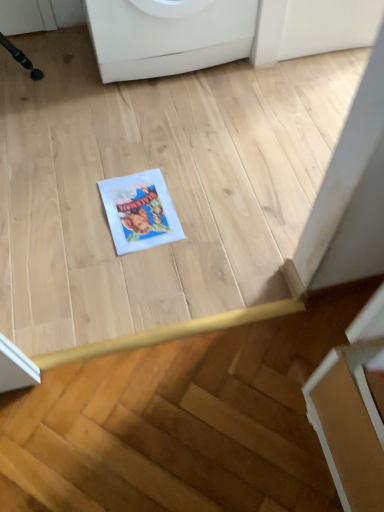
Find the location of a particular element. The height and width of the screenshot is (512, 384). white glossy washing machine at upper center is located at coordinates (168, 36).

Describe the element at coordinates (168, 36) in the screenshot. The height and width of the screenshot is (512, 384). I see `white glossy washing machine at upper center` at that location.

What do you see at coordinates (140, 211) in the screenshot?
I see `white paper comic book at center` at bounding box center [140, 211].

Locate an element on the screen. This screenshot has width=384, height=512. white paper comic book at center is located at coordinates (140, 211).

Identify the location of white glossy washing machine at upper center. The image size is (384, 512). (168, 36).

Based on their positions, is white glossy washing machine at upper center located to the left or right of white paper comic book at center?

Answer: From the image, it's evident that white glossy washing machine at upper center is to the right of white paper comic book at center.

Is white glossy washing machine at upper center positioned behind white paper comic book at center?

Yes, it is behind white paper comic book at center.

Considering the points (243, 24) and (138, 191), which point is behind, point (243, 24) or point (138, 191)?

The point (243, 24) is farther from the camera.

Looking at this image, from the image's perspective, is white glossy washing machine at upper center located above or below white paper comic book at center?

white glossy washing machine at upper center is above white paper comic book at center.

From a real-world perspective, which is physically above, white glossy washing machine at upper center or white paper comic book at center?

white glossy washing machine at upper center is physically above.

Does white glossy washing machine at upper center have a greater width compared to white paper comic book at center?

Correct, the width of white glossy washing machine at upper center exceeds that of white paper comic book at center.

Considering the sizes of objects white glossy washing machine at upper center and white paper comic book at center in the image provided, who is shorter, white glossy washing machine at upper center or white paper comic book at center?

With less height is white paper comic book at center.

Is white glossy washing machine at upper center smaller than white paper comic book at center?

Actually, white glossy washing machine at upper center might be larger than white paper comic book at center.

Is white glossy washing machine at upper center not inside white paper comic book at center?

Yes.

Is white glossy washing machine at upper center not close to white paper comic book at center?

No.

Is white glossy washing machine at upper center positioned with its back to white paper comic book at center?

No, white glossy washing machine at upper center is not facing the opposite direction of white paper comic book at center.

Can you tell me how much white glossy washing machine at upper center and white paper comic book at center differ in facing direction?

The angle between the facing direction of white glossy washing machine at upper center and the facing direction of white paper comic book at center is 2.7 degrees.

How much distance is there between white glossy washing machine at upper center and white paper comic book at center?

The distance of white glossy washing machine at upper center from white paper comic book at center is 55.09 centimeters.

Identify the location of comic book lying on the left of white glossy washing machine at upper center. (140, 211).

Does white paper comic book at center appear on the left side of white glossy washing machine at upper center?

Correct, you'll find white paper comic book at center to the left of white glossy washing machine at upper center.

Does white paper comic book at center lie in front of white glossy washing machine at upper center?

Yes, white paper comic book at center is closer to the viewer.

Which is closer, (167, 233) or (178, 59)?

Point (167, 233)

From the image's perspective, is white paper comic book at center beneath white glossy washing machine at upper center?

Yes, from the image's perspective, white paper comic book at center is beneath white glossy washing machine at upper center.

From a real-world perspective, does white paper comic book at center sit lower than white glossy washing machine at upper center?

Indeed, from a real-world perspective, white paper comic book at center is positioned beneath white glossy washing machine at upper center.

Between white paper comic book at center and white glossy washing machine at upper center, which one has smaller width?

white paper comic book at center is thinner.

Considering the sizes of objects white paper comic book at center and white glossy washing machine at upper center in the image provided, who is taller, white paper comic book at center or white glossy washing machine at upper center?

white glossy washing machine at upper center is taller.

Can you confirm if white paper comic book at center is bigger than white glossy washing machine at upper center?

Actually, white paper comic book at center might be smaller than white glossy washing machine at upper center.

Would you say white paper comic book at center contains white glossy washing machine at upper center?

No, white glossy washing machine at upper center is not a part of white paper comic book at center.

Is white paper comic book at center directly adjacent to white glossy washing machine at upper center?

No, white paper comic book at center is not in contact with white glossy washing machine at upper center.

Is white paper comic book at center oriented away from white glossy washing machine at upper center?

No, white paper comic book at center is not facing away from white glossy washing machine at upper center.

How different are the orientations of white paper comic book at center and white glossy washing machine at upper center in degrees?

The facing directions of white paper comic book at center and white glossy washing machine at upper center are 2.7 degrees apart.

Locate an element on the screen. washing machine behind the white paper comic book at center is located at coordinates (168, 36).

Where is `washing machine located above the white paper comic book at center (from a real-world perspective)`? This screenshot has width=384, height=512. washing machine located above the white paper comic book at center (from a real-world perspective) is located at coordinates (168, 36).

The image size is (384, 512). I want to click on comic book in front of the white glossy washing machine at upper center, so click(x=140, y=211).